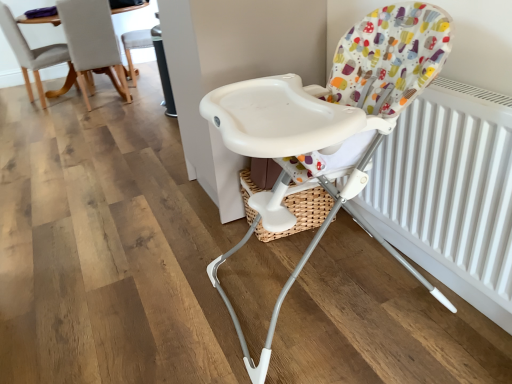
Question: Is white plastic chair at upper center, which is the 2th chair from left to right, beside light gray fabric chair at upper left, the 2th chair positioned from the front?

Choices:
 (A) no
 (B) yes

Answer: (A)

Question: Is white plastic chair at upper center, which ranks as the 2th chair in right-to-left order, not near light gray fabric chair at upper left, the 2th chair positioned from the front?

Choices:
 (A) yes
 (B) no

Answer: (B)

Question: Considering the relative sizes of white plastic chair at upper center, which ranks as the 2th chair in right-to-left order, and light gray fabric chair at upper left, placed as the 1th chair when sorted from left to right, in the image provided, is white plastic chair at upper center, which ranks as the 2th chair in right-to-left order, taller than light gray fabric chair at upper left, placed as the 1th chair when sorted from left to right,?

Choices:
 (A) yes
 (B) no

Answer: (B)

Question: Is white plastic chair at upper center, which is the 2th chair from left to right, positioned in front of light gray fabric chair at upper left, placed as the 1th chair when sorted from left to right?

Choices:
 (A) no
 (B) yes

Answer: (A)

Question: Can you confirm if white plastic chair at upper center, which appears as the third chair when viewed from the front, is bigger than light gray fabric chair at upper left, the 3th chair in the right-to-left sequence?

Choices:
 (A) yes
 (B) no

Answer: (B)

Question: Can you confirm if white plastic chair at upper center, which appears as the third chair when viewed from the front, is positioned to the left of light gray fabric chair at upper left, which appears as the 2th chair when viewed from the back?

Choices:
 (A) yes
 (B) no

Answer: (B)

Question: Is white matte radiator at right touching white plastic chair at upper center, the first chair viewed from the back?

Choices:
 (A) yes
 (B) no

Answer: (B)

Question: Is the depth of white matte radiator at right greater than that of white plastic chair at upper center, which appears as the third chair when viewed from the front?

Choices:
 (A) yes
 (B) no

Answer: (B)

Question: From the image's perspective, is white matte radiator at right under white plastic chair at upper center, which ranks as the 2th chair in right-to-left order?

Choices:
 (A) no
 (B) yes

Answer: (B)

Question: Does white matte radiator at right appear on the right side of white plastic chair at upper center, which ranks as the 2th chair in right-to-left order?

Choices:
 (A) yes
 (B) no

Answer: (A)

Question: Considering the relative sizes of white matte radiator at right and white plastic chair at upper center, the first chair viewed from the back, in the image provided, is white matte radiator at right shorter than white plastic chair at upper center, the first chair viewed from the back,?

Choices:
 (A) no
 (B) yes

Answer: (B)

Question: Could you tell me if white matte radiator at right is turned towards white plastic chair at upper center, the first chair viewed from the back?

Choices:
 (A) yes
 (B) no

Answer: (B)

Question: Could you tell me if light gray fabric chair at upper left, the 3th chair in the right-to-left sequence, is facing white plastic highchair at center, which is the 1th chair in front-to-back order?

Choices:
 (A) yes
 (B) no

Answer: (B)